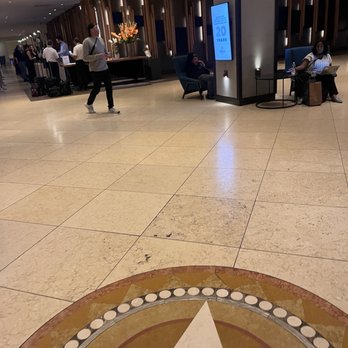
Find the location of a particular element. The width and height of the screenshot is (348, 348). reflection on tile floor is located at coordinates (225, 166), (56, 126).